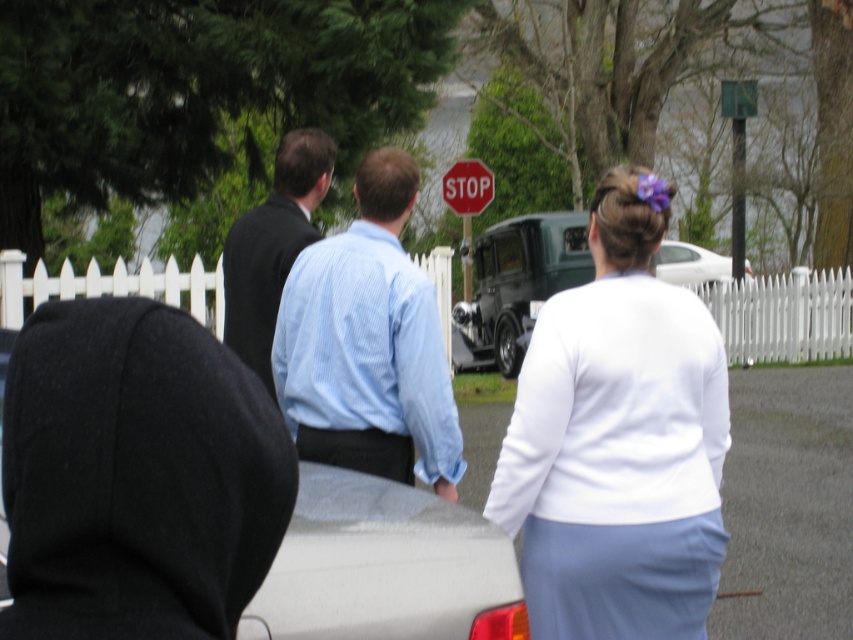
You are a pedestrian crossing the street and see the black fleece hoodie at center and the red plastic stop sign at center in the image. According to the scene, which object is positioned lower from your viewpoint?

The black fleece hoodie at center is below the red plastic stop sign at center, so the black fleece hoodie at center is positioned lower from your viewpoint.

Based on the provided scene description, where is the light blue striped shirt at center located in terms of its 2D coordinates?

The light blue striped shirt at center is located at the 2D coordinates of point (368,342).

Based on the coordinates provided, which object is located at point (368, 342) in the image?

The point (368, 342) corresponds to the light blue striped shirt at center.